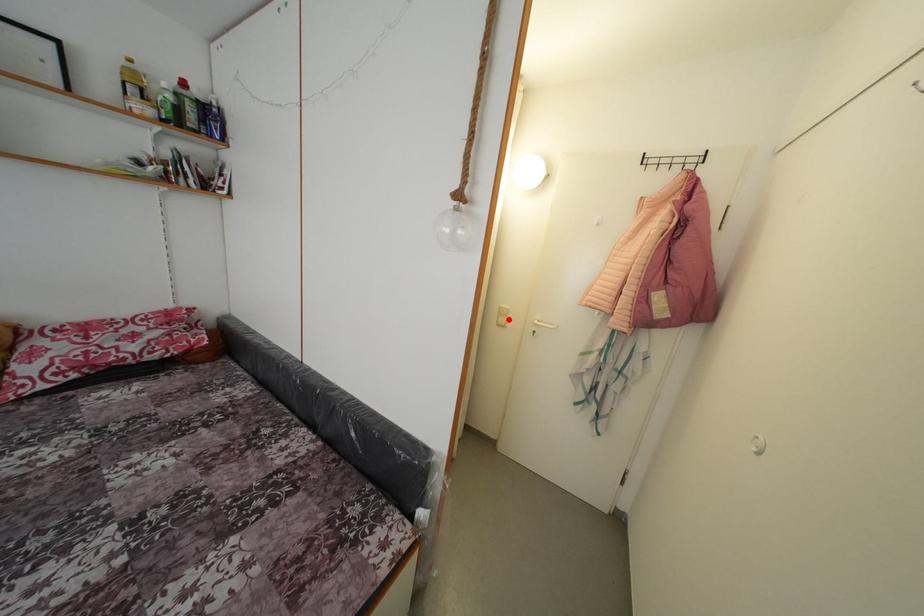
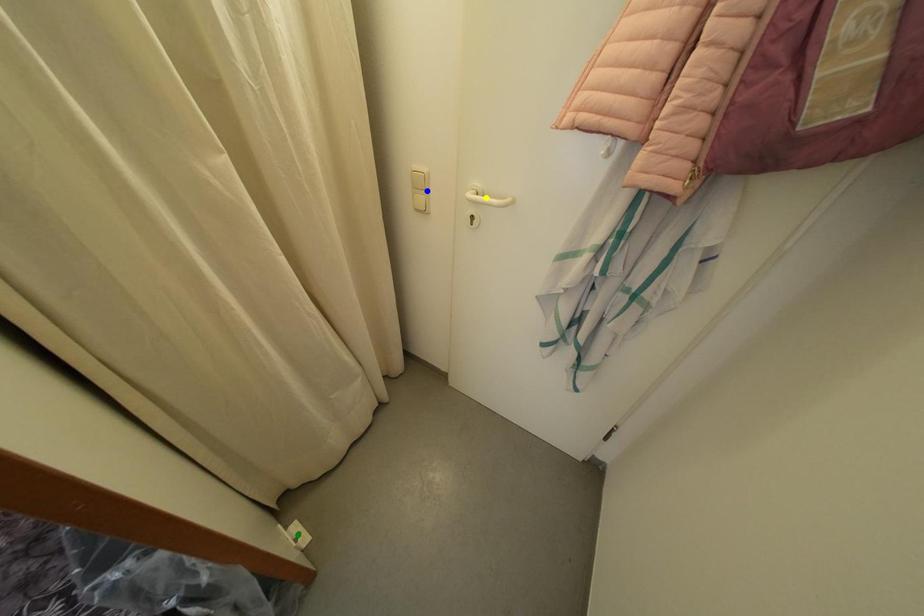
Question: I am providing you with two images of the same scene from different viewpoints. A red point is marked on the first image. You are given multiple points on the second image. Can you choose the point in image 2 that corresponds to the point in image 1?

Choices:
 (A) yellow point
 (B) blue point
 (C) green point

Answer: (B)